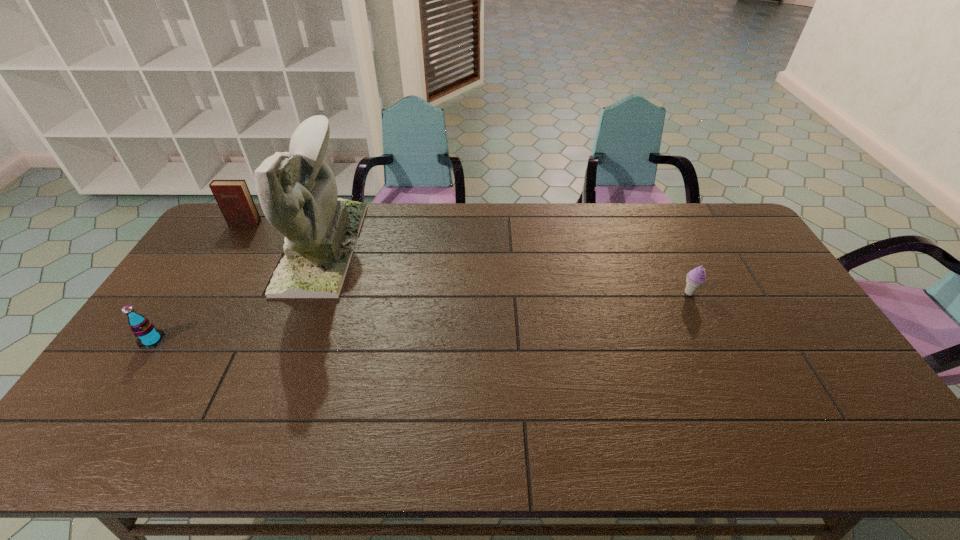
You are a GUI agent. You are given a task and a screenshot of the screen. Output one action in this format:
    pyautogui.click(x=<x>, y=<y>)
    Task: Click on the free space between the sculpture and the shortest object
    
    Given the screenshot: What is the action you would take?
    pyautogui.click(x=506, y=270)

Locate an element on the screen. This screenshot has width=960, height=540. free space between the shortest object and the nearest object is located at coordinates (420, 316).

Locate an element on the screen. This screenshot has width=960, height=540. empty location between the tallest object and the rightmost object is located at coordinates (506, 270).

You are a GUI agent. You are given a task and a screenshot of the screen. Output one action in this format:
    pyautogui.click(x=<x>, y=<y>)
    Task: Click on the vacant region between the sculpture and the diary
    This screenshot has height=540, width=960.
    Given the screenshot: What is the action you would take?
    pyautogui.click(x=283, y=235)

I want to click on empty location between the soda and the sculpture, so click(237, 294).

The width and height of the screenshot is (960, 540). In order to click on vacant region between the soda and the third shortest object in this screenshot , I will do `click(199, 282)`.

The image size is (960, 540). Find the location of `free point between the diary and the nearest object`. free point between the diary and the nearest object is located at coordinates (199, 282).

Find the location of a particular element. free space between the second shortest object and the rightmost object is located at coordinates (420, 316).

Locate an element on the screen. This screenshot has height=540, width=960. empty location between the icecream and the soda is located at coordinates (420, 316).

At what (x,y) coordinates should I click in order to perform the action: click on blank region between the second object from right to left and the third tallest object. Please return your answer as a coordinate pair (x, y). Looking at the image, I should click on (237, 294).